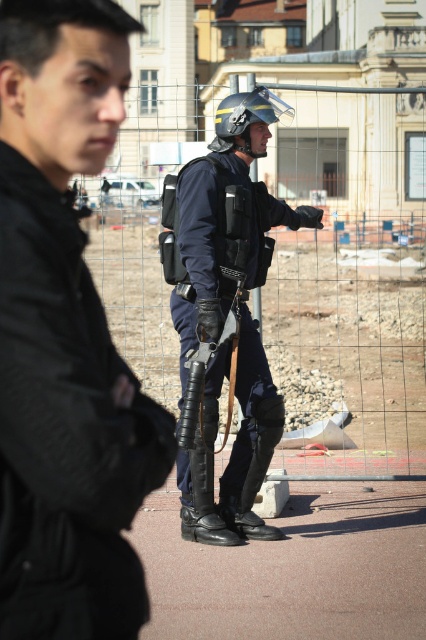
You are a pedestrian trying to cross the street and see the black matte jacket at left and the black leather boot at center. Which object is closer to you?

The black matte jacket at left is closer to you because it is in front of the black leather boot at center.

You are a pedestrian trying to cross the street and see the metal mesh fence at center and the black leather boot at center. Which object is closer to you?

The metal mesh fence at center is closer to you because it is in front of the black leather boot at center.